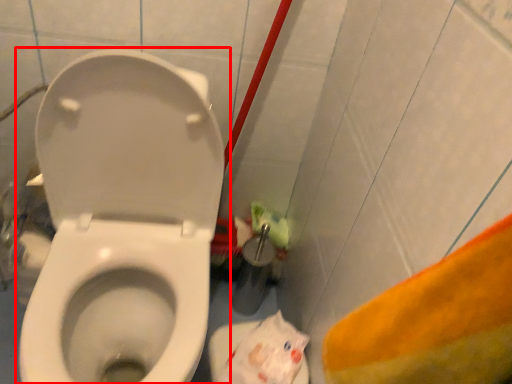
Question: Where is toilet (annotated by the red box) located in relation to paper bag in the image?

Choices:
 (A) left
 (B) right

Answer: (A)